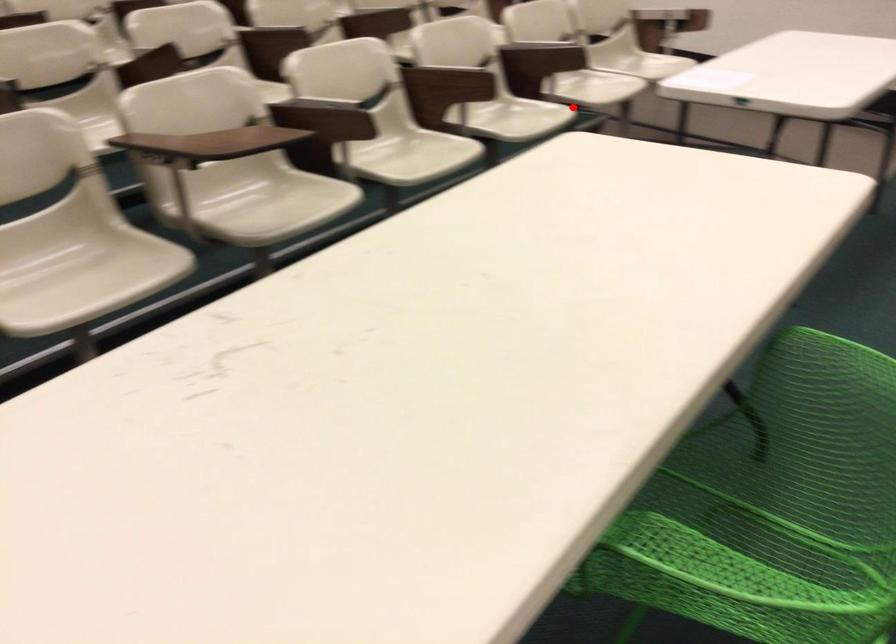
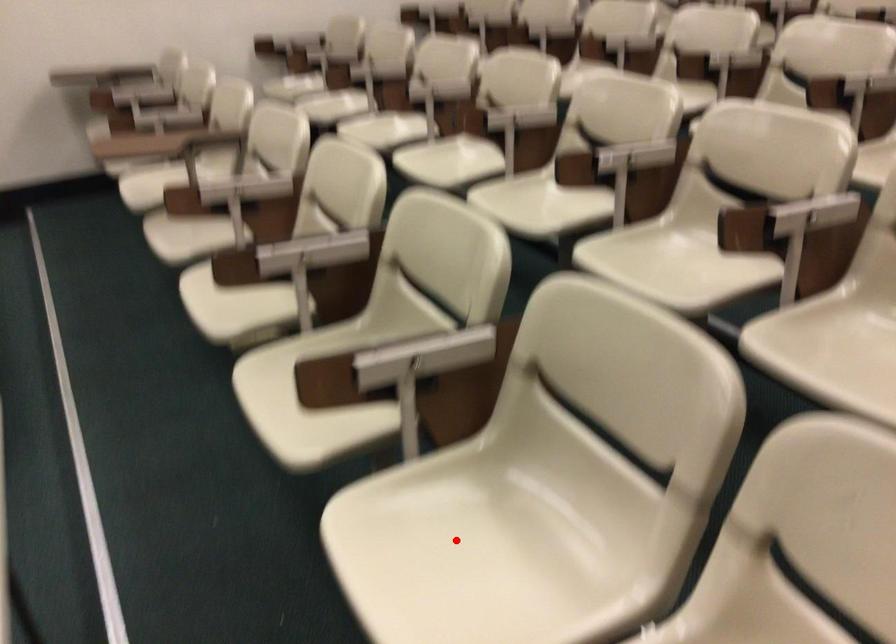
I am providing you with two images of the same scene from different viewpoints. A red point is marked on the first image and another point is marked on the second image. Are the points marked in image1 and image2 representing the same 3D position?

Yes